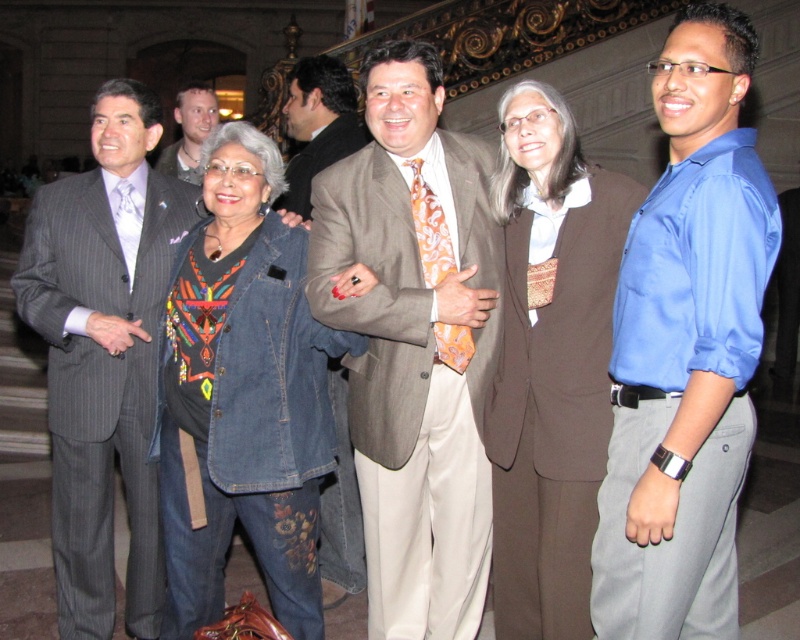
You are a photographer trying to adjust the lighting for a group photo. You notice the brown woolen suit at center and the light brown leather jacket at upper left. Which of these two items is positioned higher in the image?

The brown woolen suit at center is much taller as light brown leather jacket at upper left, so the brown woolen suit at center is positioned higher in the image.

You are a photographer adjusting your camera settings to focus on the two central figures in the group photo. The first figure is wearing a matte brown suit at center, and the second is wearing a denim jacket at center. Based on their positions, which one should you focus on first to ensure proper depth of field?

The matte brown suit at center is above the denim jacket at center, so you should focus on the matte brown suit at center first to ensure proper depth of field since it is closer to the camera.